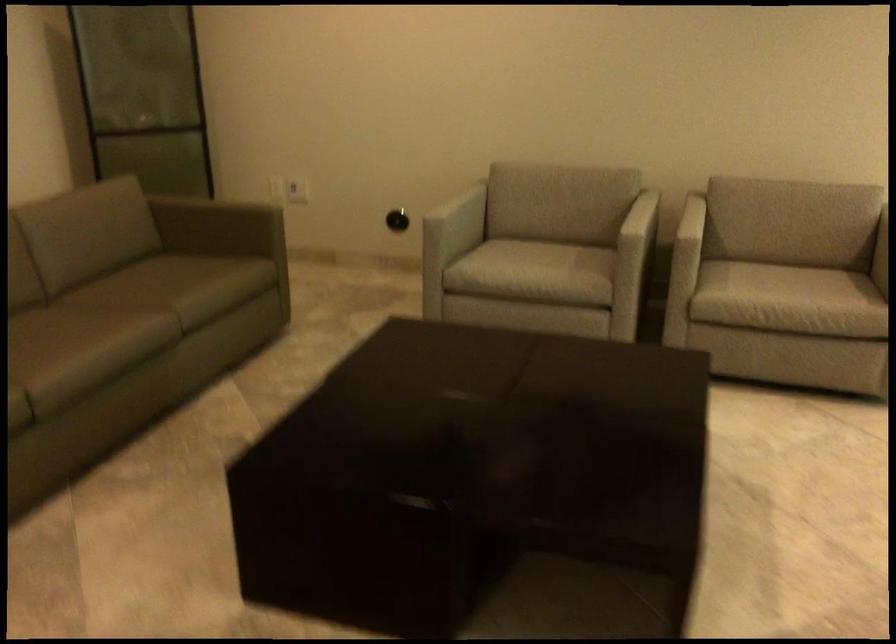
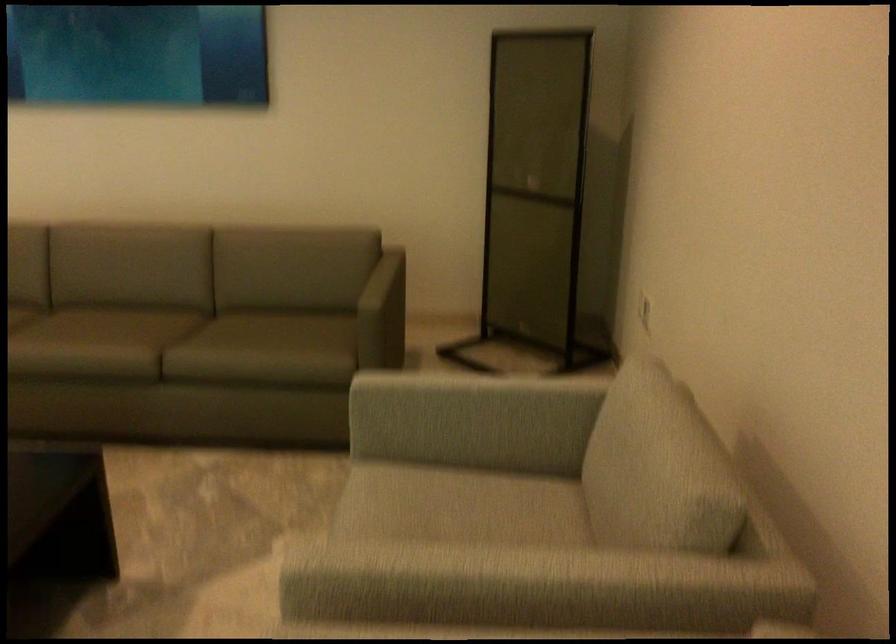
Locate, in the second image, the point that corresponds to (454,200) in the first image.

(469, 399)